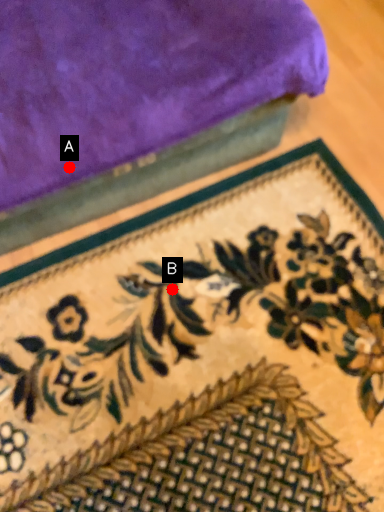
Question: Two points are circled on the image, labeled by A and B beside each circle. Which of the following is the farthest from the observer?

Choices:
 (A) A is further
 (B) B is further

Answer: (B)